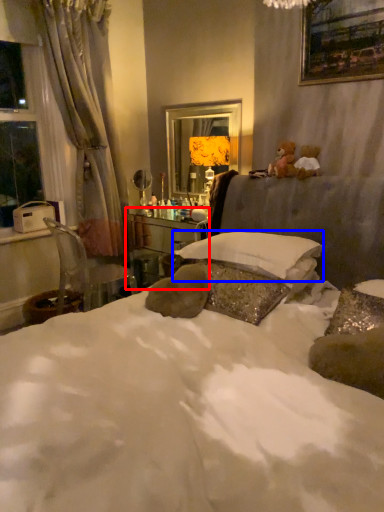
Question: Which point is further to the camera, vanity (highlighted by a red box) or pillow (highlighted by a blue box)?

Choices:
 (A) vanity
 (B) pillow

Answer: (A)